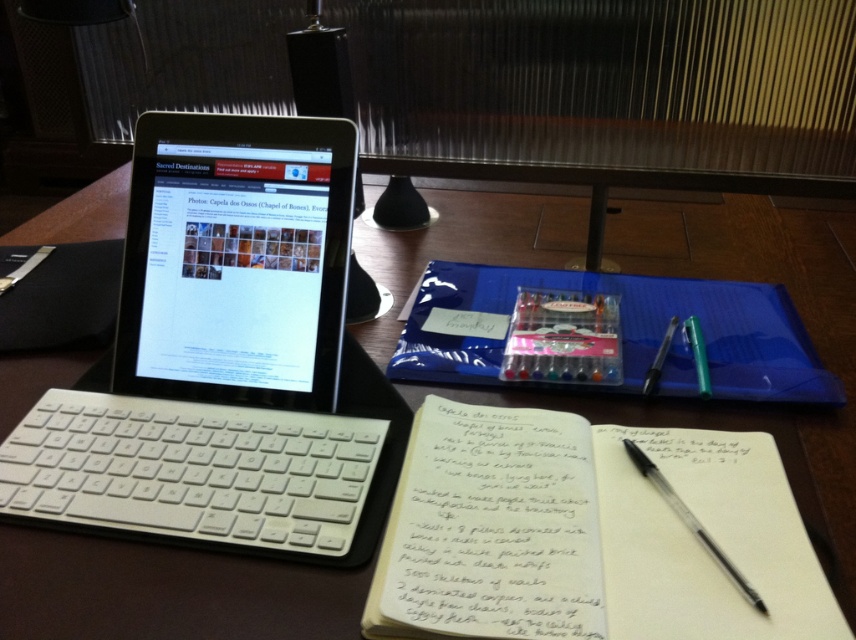
Can you confirm if white plastic laptop at left is positioned to the left of green matte pen at center?

Indeed, white plastic laptop at left is positioned on the left side of green matte pen at center.

Between white plastic laptop at left and green matte pen at center, which one appears on the left side from the viewer's perspective?

white plastic laptop at left

Does point (78, 524) lie in front of point (676, 316)?

Yes, point (78, 524) is in front of point (676, 316).

This screenshot has width=856, height=640. Identify the location of white plastic laptop at left. (224, 356).

Image resolution: width=856 pixels, height=640 pixels. Describe the element at coordinates (192, 470) in the screenshot. I see `white plastic keyboard at lower left` at that location.

Does white plastic keyboard at lower left appear on the right side of translucent plastic notebook at center?

In fact, white plastic keyboard at lower left is to the left of translucent plastic notebook at center.

Does point (46, 416) come behind point (794, 349)?

That is False.

Locate an element on the screen. white plastic keyboard at lower left is located at coordinates (192, 470).

Is point (340, 198) more distant than point (696, 352)?

No, it is in front of (696, 352).

Between white plastic laptop at left and green plastic pen at center right, which one has more height?

white plastic laptop at left

Between point (260, 282) and point (703, 378), which one is positioned in front?

Point (260, 282)

The image size is (856, 640). Identify the location of white plastic laptop at left. [224, 356].